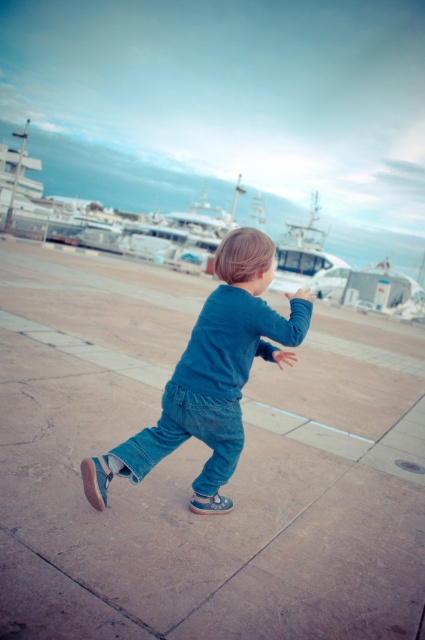
You are a delivery drone that needs to land on the brown stone pavement at center. The white glossy boat at center is nearby. Can you land safely without touching the boat?

The brown stone pavement at center has a smaller size compared to white glossy boat at center. Since the pavement is smaller, there might not be enough space to land safely without touching the boat. Check for a larger area.

You are a photographer trying to capture the child running on the brown stone pavement at center. To get a clear shot, you need to know if the denim pants at center are blocking the view of the pavement. Can you determine this?

The brown stone pavement at center is in front of denim pants at center, so the denim pants at center are not blocking the view of the pavement.